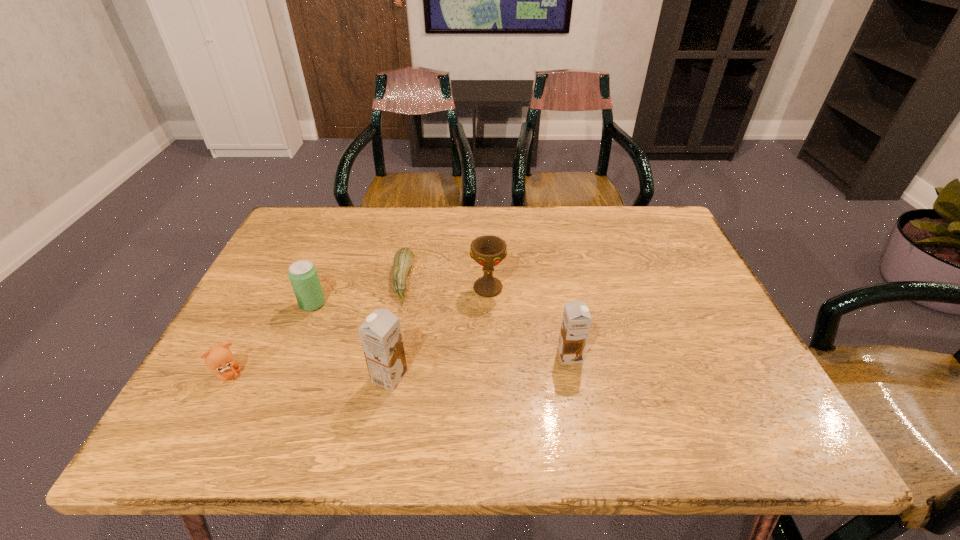
Identify the location of free space between the teddy bear and the shortest object. This screenshot has height=540, width=960. (316, 327).

The image size is (960, 540). Find the location of `free space between the second shortest object and the second object from left to right`. free space between the second shortest object and the second object from left to right is located at coordinates (271, 340).

Identify which object is located as the second nearest to the shorter chocolate milk. Please provide its 2D coordinates. Your answer should be formatted as a tuple, i.e. [(x, y)], where the tuple contains the x and y coordinates of a point satisfying the conditions above.

[(380, 334)]

Locate an element on the screen. object that stands as the second closest to the chalice is located at coordinates (576, 321).

I want to click on free space that satisfies the following two spatial constraints: 1. on the front side of the fourth tallest object; 2. on the face of the teddy bear, so click(x=284, y=375).

At what (x,y) coordinates should I click in order to perform the action: click on free space that satisfies the following two spatial constraints: 1. at the stem end of the shortest object; 2. on the right side of the fifth object from left to right. Please return your answer as a coordinate pair (x, y). This screenshot has height=540, width=960. Looking at the image, I should click on (400, 288).

Where is `free location that satisfies the following two spatial constraints: 1. at the stem end of the shortest object; 2. on the back side of the fifth object from left to right`? free location that satisfies the following two spatial constraints: 1. at the stem end of the shortest object; 2. on the back side of the fifth object from left to right is located at coordinates (400, 288).